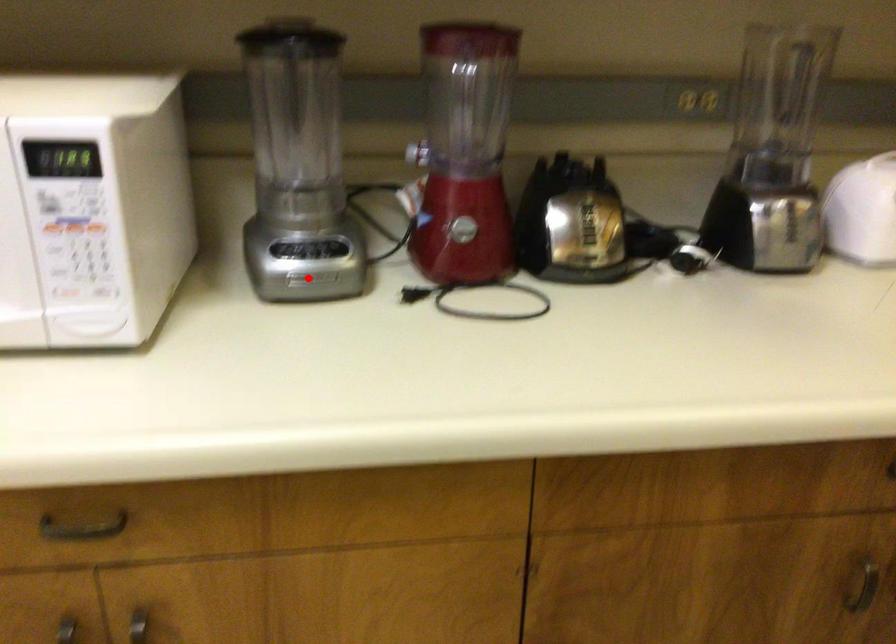
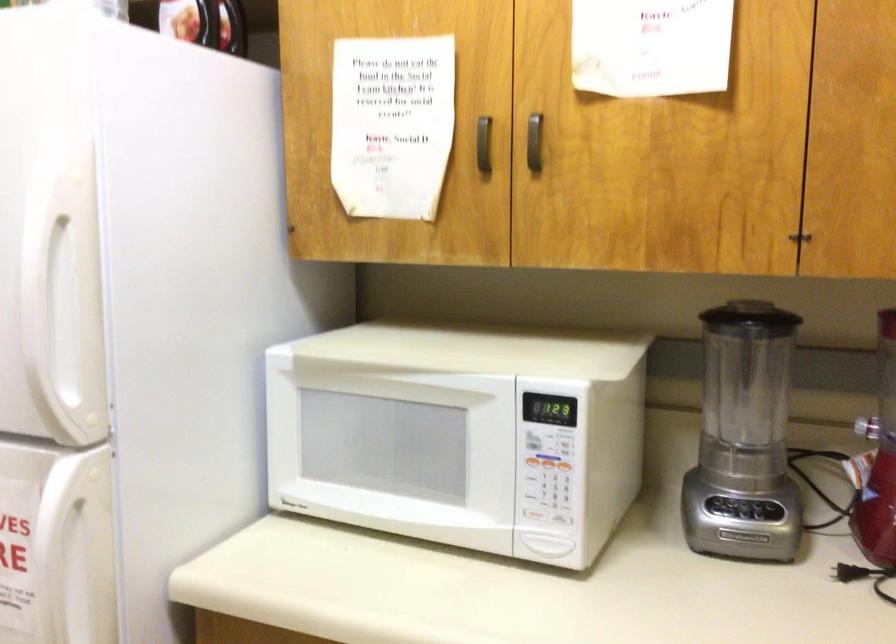
Find the pixel in the second image that matches the highlighted location in the first image.

(743, 536)